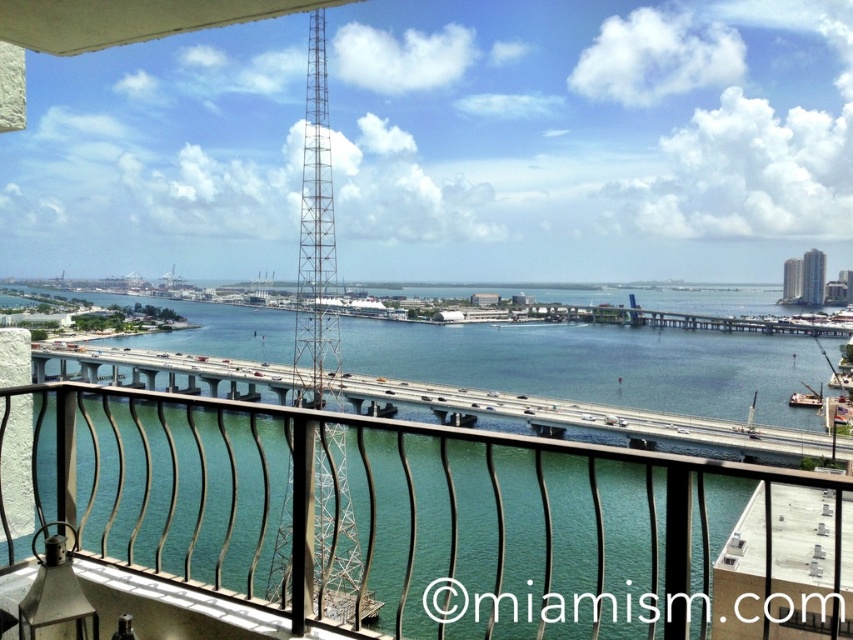
Question: Does clear blue water at center appear on the right side of metallic lattice tower at center?

Choices:
 (A) no
 (B) yes

Answer: (A)

Question: Is clear blue water at center thinner than metallic lattice tower at center?

Choices:
 (A) no
 (B) yes

Answer: (A)

Question: Does clear blue water at center lie in front of metallic lattice tower at center?

Choices:
 (A) no
 (B) yes

Answer: (A)

Question: Among these objects, which one is farthest from the camera?

Choices:
 (A) clear blue water at center
 (B) metallic lattice tower at center

Answer: (A)

Question: Which point appears farthest from the camera in this image?

Choices:
 (A) (647, 356)
 (B) (316, 541)

Answer: (A)